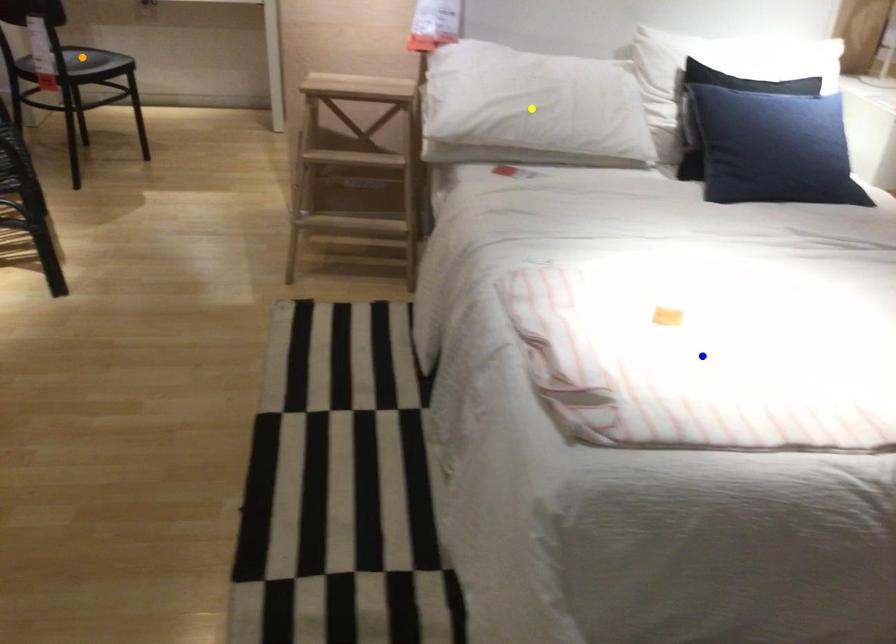
Order these from farthest to nearest:
A) orange point
B) yellow point
C) blue point

Answer: orange point
yellow point
blue point